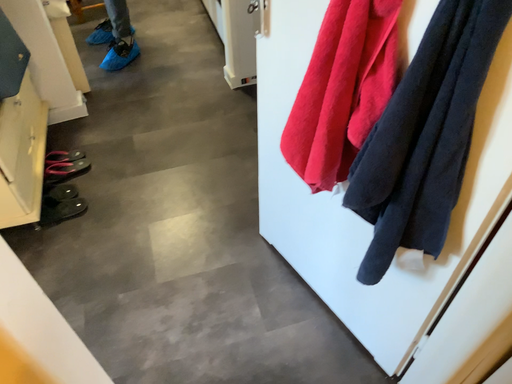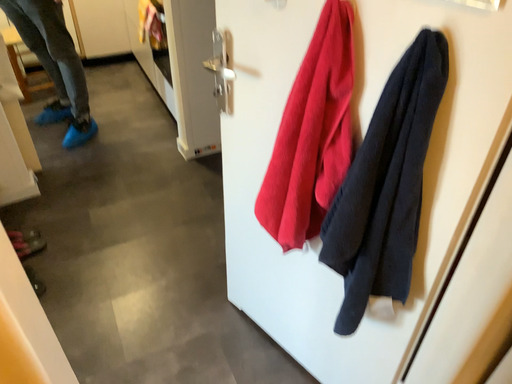
Question: Which way did the camera rotate in the video?

Choices:
 (A) rotated left
 (B) rotated right

Answer: (B)